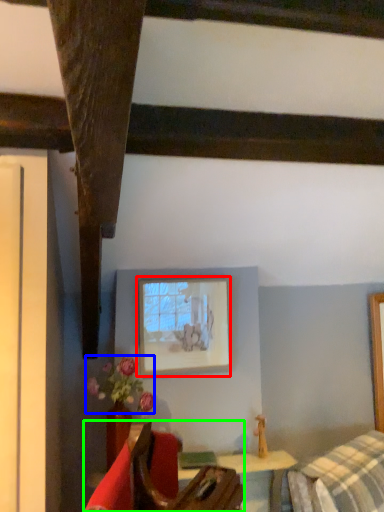
Question: Estimate the real-world distances between objects in this image. Which object is closer to picture frame (highlighted by a red box), flower (highlighted by a blue box) or furniture (highlighted by a green box)?

Choices:
 (A) flower
 (B) furniture

Answer: (A)